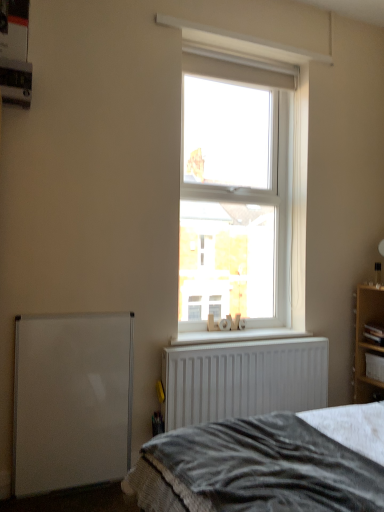
Question: Can you confirm if clear glass window at center is wider than wooden cabinet at right?

Choices:
 (A) no
 (B) yes

Answer: (A)

Question: From the image's perspective, would you say clear glass window at center is positioned over wooden cabinet at right?

Choices:
 (A) no
 (B) yes

Answer: (B)

Question: Is clear glass window at center with wooden cabinet at right?

Choices:
 (A) yes
 (B) no

Answer: (B)

Question: Are clear glass window at center and wooden cabinet at right far apart?

Choices:
 (A) no
 (B) yes

Answer: (B)

Question: Is clear glass window at center positioned with its back to wooden cabinet at right?

Choices:
 (A) yes
 (B) no

Answer: (B)

Question: Is clear glass window at center taller than wooden cabinet at right?

Choices:
 (A) no
 (B) yes

Answer: (B)

Question: Considering the relative sizes of white textured wood at center and wooden shelf at right in the image provided, is white textured wood at center smaller than wooden shelf at right?

Choices:
 (A) no
 (B) yes

Answer: (B)

Question: Can you confirm if white textured wood at center is positioned to the right of wooden shelf at right?

Choices:
 (A) yes
 (B) no

Answer: (B)

Question: Considering the relative sizes of white textured wood at center and wooden shelf at right in the image provided, is white textured wood at center bigger than wooden shelf at right?

Choices:
 (A) yes
 (B) no

Answer: (B)

Question: Does white textured wood at center have a lesser height compared to wooden shelf at right?

Choices:
 (A) yes
 (B) no

Answer: (A)

Question: From a real-world perspective, is white textured wood at center over wooden shelf at right?

Choices:
 (A) yes
 (B) no

Answer: (A)

Question: From a real-world perspective, is white textured wood at center below wooden shelf at right?

Choices:
 (A) no
 (B) yes

Answer: (A)

Question: Is white textured wood at center not near wooden cabinet at right?

Choices:
 (A) no
 (B) yes

Answer: (A)